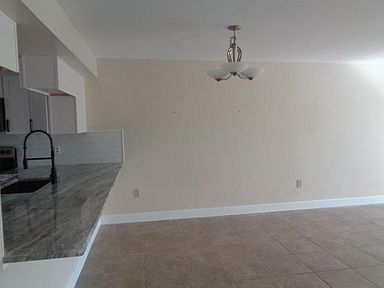
Where is `counter`? counter is located at coordinates (78, 209).